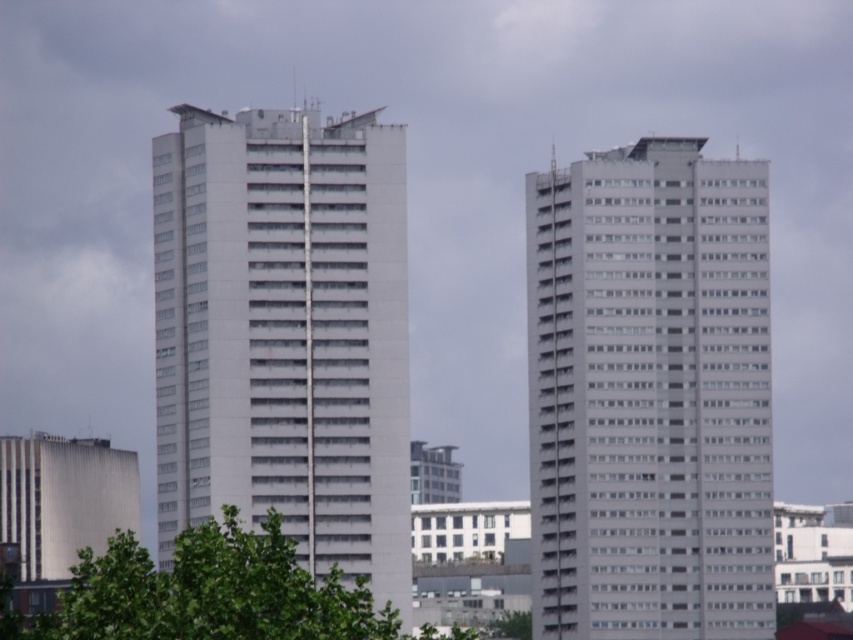
Between white smooth building at right and white smooth building at center, which one is positioned lower?

Positioned lower is white smooth building at right.

Does white smooth building at right have a smaller size compared to white smooth building at center?

Yes, white smooth building at right is smaller than white smooth building at center.

The image size is (853, 640). Find the location of `white smooth building at right`. white smooth building at right is located at coordinates (648, 396).

Who is taller, white smooth building at center or green leafy tree at center?

Standing taller between the two is white smooth building at center.

The width and height of the screenshot is (853, 640). What do you see at coordinates (283, 333) in the screenshot?
I see `white smooth building at center` at bounding box center [283, 333].

The height and width of the screenshot is (640, 853). What are the coordinates of `white smooth building at center` in the screenshot? It's located at (283, 333).

Can you confirm if white smooth building at right is bigger than green leafy tree at center?

No.

What do you see at coordinates (648, 396) in the screenshot?
I see `white smooth building at right` at bounding box center [648, 396].

I want to click on white smooth building at right, so click(648, 396).